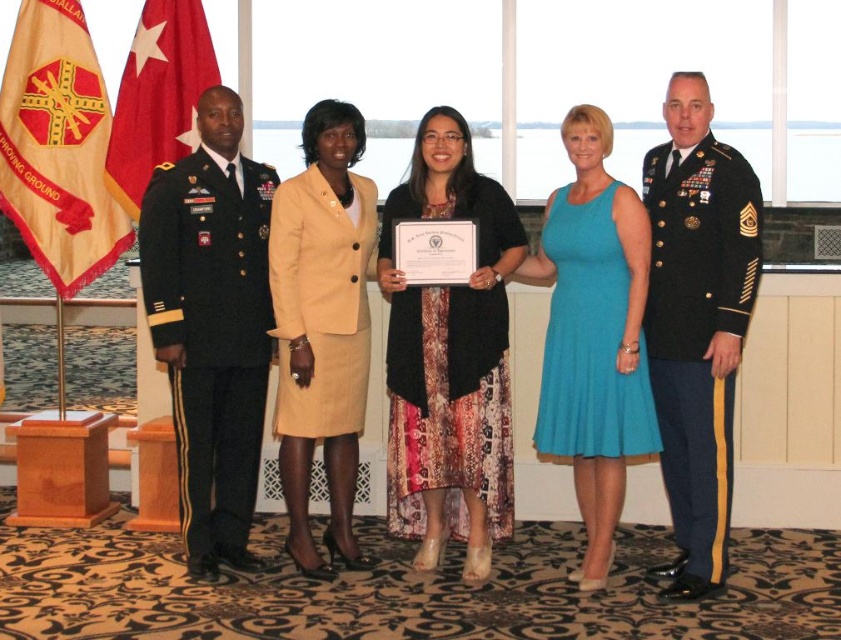
Based on the scene description, where is the shiny black uniform at right located in terms of coordinates?

The shiny black uniform at right is located at coordinates (697, 332).

Looking at this image, you are organizing a photo shoot and need to arrange two outfits from the image for a display. The shiny black uniform at right and the black matte dress at center must be placed side by side. Which outfit should be placed on the left side to make the display look balanced?

The shiny black uniform at right should be placed on the left side of the display because it is larger in size than the black matte dress at center, creating a balanced arrangement.